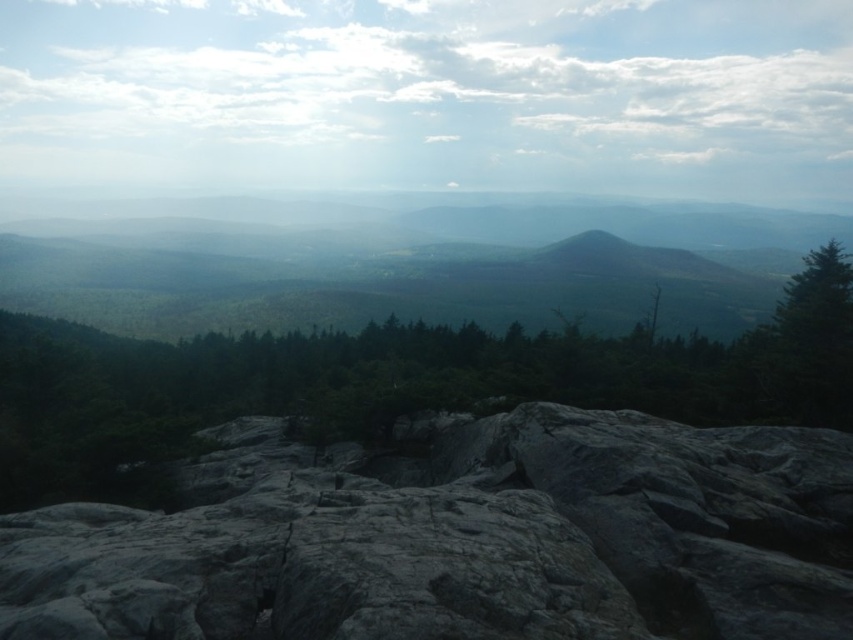
Consider the image. You are a hiker standing at the edge of the rocky outcrop and want to reach the green matte tree at center. Which direction should you move relative to the gray rough rock at center?

You should move to the right side of the gray rough rock at center to reach the green matte tree at center since the gray rough rock at center is positioned on the left side of the green matte tree at center.

You are planning to place a small garden statue that is 1 meter wide between the gray rough rock at center and the green matte tree at center. Based on the scene, will the statue fit comfortably between them?

The gray rough rock at center is narrower than the green matte tree at center. However, the exact distance between them isn not specified. Therefore, it is uncertain if the 1 meter wide statue will fit comfortably between them.

You are standing at the highest point of the rocky outcrop and want to navigate to a specific location. You see two points marked as point (3, 592) and point (344, 412). Which point is closer to you?

Point (3, 592) is in front of point (344, 412), so it is closer to you.